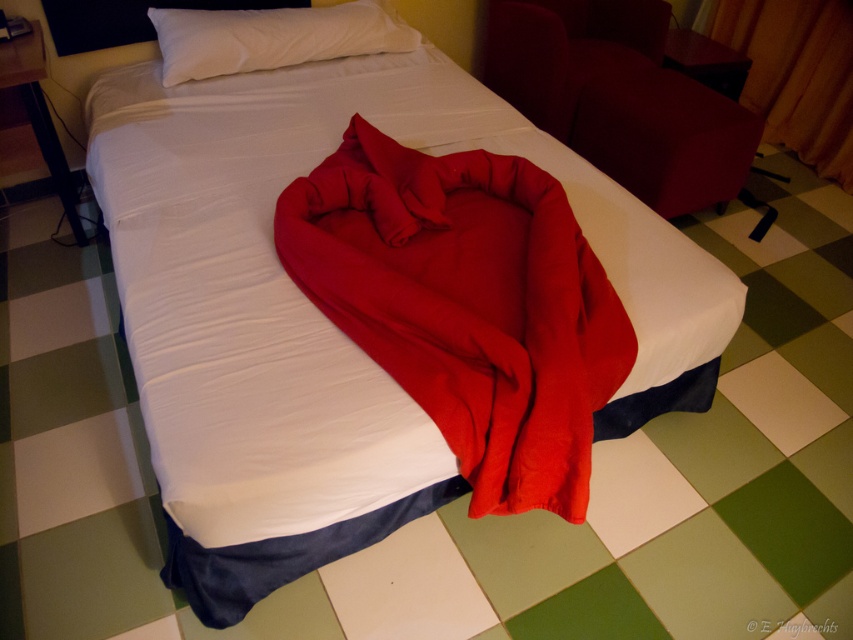
Question: Is orange fabric curtain at upper right to the right of white soft pillow at upper center from the viewer's perspective?

Choices:
 (A) no
 (B) yes

Answer: (B)

Question: Is red soft fabric blanket at center closer to camera compared to orange fabric curtain at upper right?

Choices:
 (A) yes
 (B) no

Answer: (A)

Question: Is red soft fabric blanket at center in front of orange fabric curtain at upper right?

Choices:
 (A) yes
 (B) no

Answer: (A)

Question: Which of these objects is positioned closest to the white soft pillow at upper center?

Choices:
 (A) red soft fabric blanket at center
 (B) orange fabric curtain at upper right

Answer: (A)

Question: Which object is farther from the camera taking this photo?

Choices:
 (A) white soft pillow at upper center
 (B) orange fabric curtain at upper right
 (C) red soft fabric blanket at center

Answer: (B)

Question: Which object is farther from the camera taking this photo?

Choices:
 (A) orange fabric curtain at upper right
 (B) red soft fabric blanket at center
 (C) white soft pillow at upper center

Answer: (A)